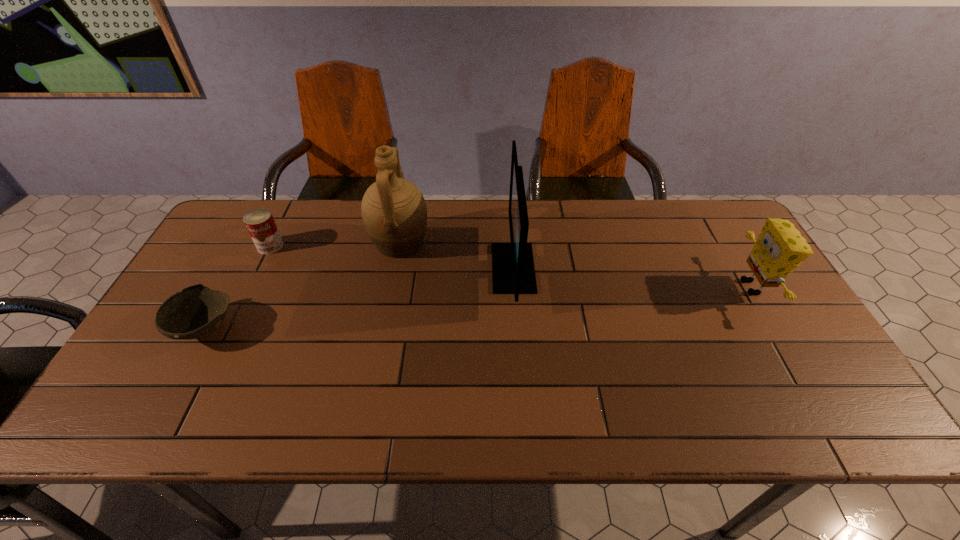
Identify the location of object that is at the right edge. (780, 248).

Identify the location of object located at the far left corner. (260, 223).

The image size is (960, 540). I want to click on free space at the far edge of the desktop, so click(x=540, y=205).

At what (x,y) coordinates should I click in order to perform the action: click on vacant space at the left edge. Please return your answer as a coordinate pair (x, y). The height and width of the screenshot is (540, 960). Looking at the image, I should click on (164, 339).

In the image, there is a desktop. Identify the location of vacant space at the right edge. (737, 253).

At what (x,y) coordinates should I click in order to perform the action: click on vacant space at the far left corner. Please return your answer as a coordinate pair (x, y). Looking at the image, I should click on pyautogui.click(x=234, y=227).

Where is `vacant point located between the second shortest object and the third object from left to right`? The height and width of the screenshot is (540, 960). vacant point located between the second shortest object and the third object from left to right is located at coordinates (335, 245).

Find the location of `unoccupied position between the shortest object and the third object from left to right`. unoccupied position between the shortest object and the third object from left to right is located at coordinates (302, 286).

Identify the location of unoccupied area between the shortest object and the can. The image size is (960, 540). (238, 287).

You are a GUI agent. You are given a task and a screenshot of the screen. Output one action in this format:
    pyautogui.click(x=<x>, y=<y>)
    Task: Click on the unoccupied position between the third tallest object and the pitcher
    The width and height of the screenshot is (960, 540).
    Given the screenshot: What is the action you would take?
    pyautogui.click(x=576, y=265)